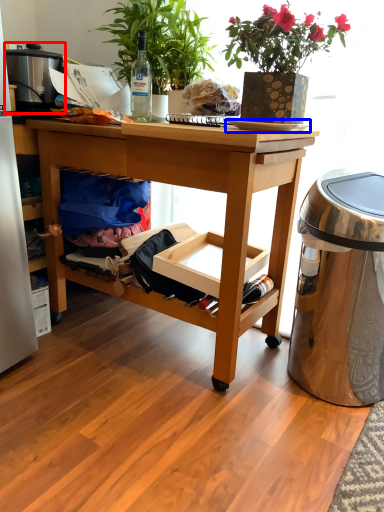
Question: Which object is further to the camera taking this photo, appliance (highlighted by a red box) or plate (highlighted by a blue box)?

Choices:
 (A) appliance
 (B) plate

Answer: (A)